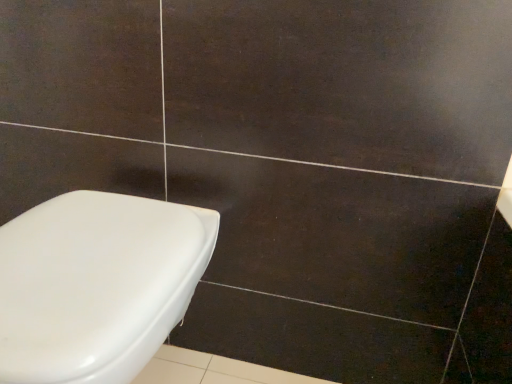
The height and width of the screenshot is (384, 512). What are the coordinates of `vacant area on top of white glossy toilet at lower left (from a real-world perspective)` in the screenshot? It's located at (86, 240).